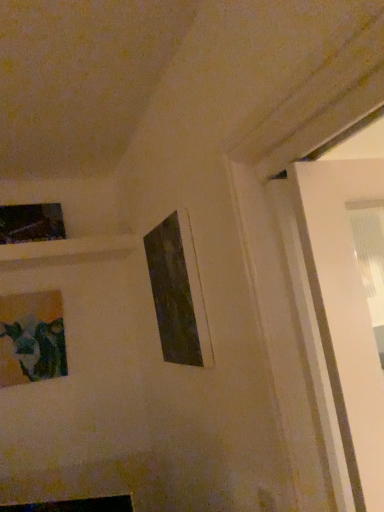
Question: Can you confirm if matte glass picture frame at lower left, the second picture frame from the right, is shorter than matte black picture frame at upper left, the third picture frame positioned from the front?

Choices:
 (A) yes
 (B) no

Answer: (B)

Question: Is matte glass picture frame at lower left, the second picture frame from the right, closer to camera compared to matte black picture frame at upper left, the third picture frame positioned from the front?

Choices:
 (A) no
 (B) yes

Answer: (B)

Question: From the image's perspective, is matte glass picture frame at lower left, which is the 2th picture frame from left to right, above matte black picture frame at upper left, the first picture frame from the left?

Choices:
 (A) no
 (B) yes

Answer: (A)

Question: Is matte glass picture frame at lower left, acting as the second picture frame starting from the back, to the left of matte black picture frame at upper left, which is the 3th picture frame in right-to-left order, from the viewer's perspective?

Choices:
 (A) no
 (B) yes

Answer: (A)

Question: Can you confirm if matte glass picture frame at lower left, which is the 2th picture frame from left to right, is positioned to the right of matte black picture frame at upper left, acting as the 1th picture frame starting from the back?

Choices:
 (A) no
 (B) yes

Answer: (B)

Question: Is matte glass picture frame at lower left, which is counted as the second picture frame, starting from the front, situated inside matte black picture frame at upper left, acting as the 1th picture frame starting from the back, or outside?

Choices:
 (A) inside
 (B) outside

Answer: (B)

Question: From the image's perspective, is matte glass picture frame at lower left, acting as the second picture frame starting from the back, above or below matte black picture frame at upper left, which is the 3th picture frame in right-to-left order?

Choices:
 (A) above
 (B) below

Answer: (B)

Question: From a real-world perspective, is matte glass picture frame at lower left, acting as the second picture frame starting from the back, positioned above or below matte black picture frame at upper left, which is the 3th picture frame in right-to-left order?

Choices:
 (A) above
 (B) below

Answer: (B)

Question: Is matte glass picture frame at lower left, the second picture frame from the right, in front of or behind matte black picture frame at upper left, the first picture frame from the left, in the image?

Choices:
 (A) front
 (B) behind

Answer: (A)

Question: From the image's perspective, is matte black picture frame at upper left, the third picture frame positioned from the front, located above or below matte glass picture frame at lower left, which is the 2th picture frame from left to right?

Choices:
 (A) above
 (B) below

Answer: (A)

Question: Considering the positions of matte black picture frame at upper left, the first picture frame from the left, and matte glass picture frame at lower left, which is the 2th picture frame from left to right, in the image, is matte black picture frame at upper left, the first picture frame from the left, taller or shorter than matte glass picture frame at lower left, which is the 2th picture frame from left to right,?

Choices:
 (A) tall
 (B) short

Answer: (B)

Question: Is matte black picture frame at upper left, which is the 3th picture frame in right-to-left order, spatially inside matte glass picture frame at lower left, which is the 2th picture frame from left to right, or outside of it?

Choices:
 (A) inside
 (B) outside

Answer: (B)

Question: In terms of width, does matte black picture frame at upper left, the first picture frame from the left, look wider or thinner when compared to matte glass picture frame at lower left, which is the 2th picture frame from left to right?

Choices:
 (A) thin
 (B) wide

Answer: (B)

Question: Is matte black picture frame at center, the 3th picture frame positioned from the left, inside the boundaries of matte glass picture frame at lower left, the second picture frame from the right, or outside?

Choices:
 (A) outside
 (B) inside

Answer: (A)

Question: From the image's perspective, is matte black picture frame at center, the third picture frame from the back, located above or below matte glass picture frame at lower left, which is the 2th picture frame from left to right?

Choices:
 (A) above
 (B) below

Answer: (A)